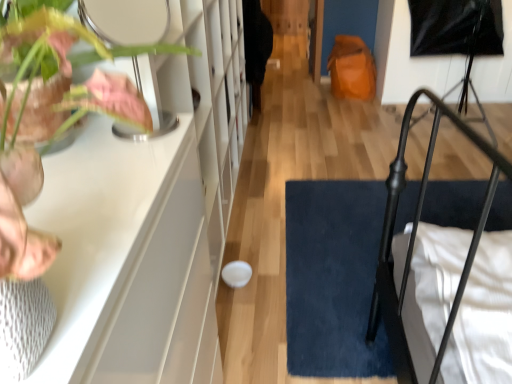
Question: Is matte pink leaf at left outside of dark blue plush doormat at lower right?

Choices:
 (A) yes
 (B) no

Answer: (A)

Question: Is matte pink leaf at left shorter than dark blue plush doormat at lower right?

Choices:
 (A) no
 (B) yes

Answer: (A)

Question: Does matte pink leaf at left have a greater height compared to dark blue plush doormat at lower right?

Choices:
 (A) yes
 (B) no

Answer: (A)

Question: Does matte pink leaf at left appear on the left side of dark blue plush doormat at lower right?

Choices:
 (A) no
 (B) yes

Answer: (B)

Question: Is matte pink leaf at left further to the viewer compared to dark blue plush doormat at lower right?

Choices:
 (A) yes
 (B) no

Answer: (B)

Question: Does matte pink leaf at left appear on the right side of dark blue plush doormat at lower right?

Choices:
 (A) yes
 (B) no

Answer: (B)

Question: Is dark blue plush doormat at lower right to the right of matte pink leaf at left from the viewer's perspective?

Choices:
 (A) no
 (B) yes

Answer: (B)

Question: Is dark blue plush doormat at lower right facing away from matte pink leaf at left?

Choices:
 (A) no
 (B) yes

Answer: (A)

Question: Considering the relative positions of dark blue plush doormat at lower right and matte pink leaf at left in the image provided, is dark blue plush doormat at lower right to the left of matte pink leaf at left from the viewer's perspective?

Choices:
 (A) no
 (B) yes

Answer: (A)

Question: Is dark blue plush doormat at lower right located outside matte pink leaf at left?

Choices:
 (A) no
 (B) yes

Answer: (B)

Question: Is dark blue plush doormat at lower right touching matte pink leaf at left?

Choices:
 (A) no
 (B) yes

Answer: (A)

Question: Can you confirm if dark blue plush doormat at lower right is wider than matte pink leaf at left?

Choices:
 (A) no
 (B) yes

Answer: (B)

Question: Considering their positions, is matte pink leaf at left located in front of or behind dark blue plush doormat at lower right?

Choices:
 (A) front
 (B) behind

Answer: (A)